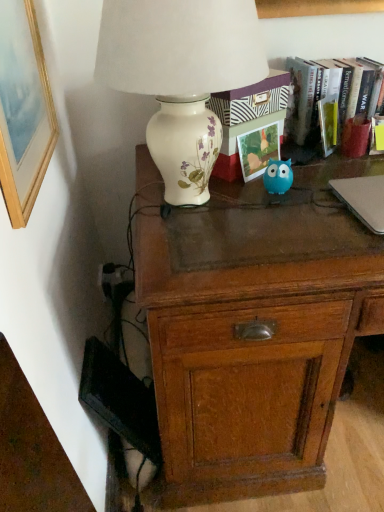
Locate an element on the screen. The width and height of the screenshot is (384, 512). free location to the right of blue rubber toy at center is located at coordinates (318, 184).